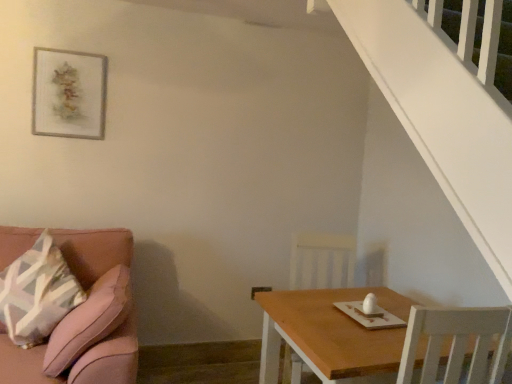
The width and height of the screenshot is (512, 384). Describe the element at coordinates (322, 261) in the screenshot. I see `wooden chair at lower right` at that location.

Measure the distance between point (270, 292) and camera.

Point (270, 292) is 7.07 feet from camera.

Where is `wooden chair at lower right`? The height and width of the screenshot is (384, 512). wooden chair at lower right is located at coordinates (322, 261).

Does wooden chair at lower right have a lesser height compared to wooden picture frame at upper left?

In fact, wooden chair at lower right may be taller than wooden picture frame at upper left.

From a real-world perspective, which object rests below the other?

wooden chair at lower right.

What are the coordinates of `armchair beneath the wooden picture frame at upper left (from a real-world perspective)` in the screenshot? It's located at (322, 261).

Does wooden picture frame at upper left have a greater height compared to wooden table at lower right?

Incorrect, the height of wooden picture frame at upper left is not larger of that of wooden table at lower right.

From the image's perspective, is wooden picture frame at upper left on top of wooden table at lower right?

Yes, from the image's perspective, wooden picture frame at upper left is above wooden table at lower right.

Is wooden picture frame at upper left inside or outside of wooden table at lower right?

wooden picture frame at upper left is outside wooden table at lower right.

From a real-world perspective, is pink fabric couch at left below wooden chair at lower right?

Correct, in the physical world, pink fabric couch at left is lower than wooden chair at lower right.

Which is more to the left, pink fabric couch at left or wooden chair at lower right?

pink fabric couch at left.

Does pink fabric couch at left have a lesser width compared to wooden chair at lower right?

Incorrect, the width of pink fabric couch at left is not less than that of wooden chair at lower right.

From the image's perspective, is pink fabric couch at left under wooden chair at lower right?

No.

Do you think wooden table at lower right is within wooden picture frame at upper left, or outside of it?

wooden table at lower right is outside wooden picture frame at upper left.

Measure the distance between wooden table at lower right and wooden picture frame at upper left.

1.71 meters.

Considering the positions of points (382, 290) and (70, 137), is point (382, 290) farther from camera compared to point (70, 137)?

That is False.

Is wooden table at lower right directly adjacent to wooden picture frame at upper left?

No, wooden table at lower right is not making contact with wooden picture frame at upper left.

Find the location of a particular element. table below the pink fabric couch at left (from a real-world perspective) is located at coordinates (331, 335).

Is pink fabric couch at left at the left side of wooden table at lower right?

Yes, pink fabric couch at left is to the left of wooden table at lower right.

Is pink fabric couch at left wider or thinner than wooden table at lower right?

In the image, pink fabric couch at left appears to be wider than wooden table at lower right.

Are pink fabric couch at left and wooden table at lower right making contact?

pink fabric couch at left is not next to wooden table at lower right, and they're not touching.

Based on the photo, which is more to the left, wooden picture frame at upper left or wooden chair at lower right?

Positioned to the left is wooden picture frame at upper left.

Between wooden picture frame at upper left and wooden chair at lower right, which one has less height?

With less height is wooden picture frame at upper left.

Find the location of a particular element. The image size is (512, 384). armchair lying in front of the wooden picture frame at upper left is located at coordinates (322, 261).

Relative to wooden chair at lower right, is wooden picture frame at upper left in front or behind?

wooden picture frame at upper left is behind wooden chair at lower right.

Is pink fabric couch at left bigger or smaller than wooden picture frame at upper left?

Considering their sizes, pink fabric couch at left takes up more space than wooden picture frame at upper left.

How distant is pink fabric couch at left from wooden picture frame at upper left?

pink fabric couch at left is 36.17 inches from wooden picture frame at upper left.

From the picture: Considering their positions, is pink fabric couch at left located in front of or behind wooden picture frame at upper left?

pink fabric couch at left is in front of wooden picture frame at upper left.

From the image's perspective, does pink fabric couch at left appear higher than wooden picture frame at upper left?

No, from the image's perspective, pink fabric couch at left is not above wooden picture frame at upper left.

I want to click on armchair on the right of the wooden picture frame at upper left, so click(x=322, y=261).

I want to click on table in front of the wooden picture frame at upper left, so click(331, 335).

Which object lies further to the anchor point pink fabric couch at left, wooden table at lower right or wooden picture frame at upper left?

wooden picture frame at upper left is positioned further to the anchor pink fabric couch at left.

From the image, which object appears to be farther from wooden picture frame at upper left, pink fabric couch at left or wooden table at lower right?

wooden table at lower right is positioned further to the anchor wooden picture frame at upper left.

In the scene shown: Considering their positions, is wooden chair at lower right positioned closer to pink fabric couch at left than wooden picture frame at upper left?

Among the two, wooden picture frame at upper left is located nearer to pink fabric couch at left.

Looking at the image, which one is located further to pink fabric couch at left, wooden table at lower right or wooden chair at lower right?

wooden chair at lower right.

From the image, which object appears to be nearer to wooden table at lower right, wooden chair at lower right or pink fabric couch at left?

wooden chair at lower right.

Looking at this image, looking at the image, which one is located further to wooden chair at lower right, wooden picture frame at upper left or wooden table at lower right?

wooden picture frame at upper left.

Looking at the image, which one is located further to pink fabric couch at left, wooden picture frame at upper left or wooden table at lower right?

Among the two, wooden picture frame at upper left is located further to pink fabric couch at left.

Based on their spatial positions, is wooden table at lower right or wooden chair at lower right further from wooden picture frame at upper left?

Based on the image, wooden table at lower right appears to be further to wooden picture frame at upper left.

In order to click on armchair situated between wooden picture frame at upper left and wooden table at lower right from left to right in this screenshot , I will do `click(322, 261)`.

Locate an element on the screen. armchair located between pink fabric couch at left and wooden table at lower right in the left-right direction is located at coordinates (322, 261).

The width and height of the screenshot is (512, 384). Identify the location of studio couch between wooden picture frame at upper left and wooden table at lower right. (86, 318).

Where is `studio couch located between wooden picture frame at upper left and wooden chair at lower right in the left-right direction`? The width and height of the screenshot is (512, 384). studio couch located between wooden picture frame at upper left and wooden chair at lower right in the left-right direction is located at coordinates (86, 318).